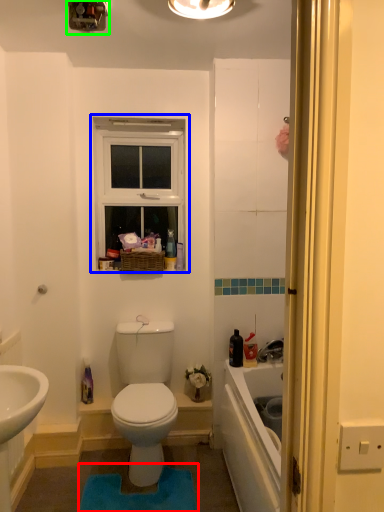
Question: Considering the real-world distances, which object is closest to bath mat (highlighted by a red box)? window (highlighted by a blue box) or light fixture (highlighted by a green box).

Choices:
 (A) window
 (B) light fixture

Answer: (A)